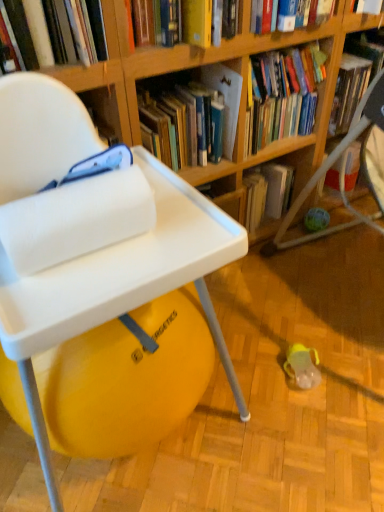
Question: Is hardcover book at upper left, which appears as the 3th book when viewed from the right, inside or outside of wooden bookshelf at center, which appears as the second shelf when viewed from the front?

Choices:
 (A) inside
 (B) outside

Answer: (B)

Question: From a real-world perspective, is hardcover book at upper left, which is counted as the first book, starting from the left, physically located above or below wooden bookshelf at center, placed as the 2th shelf when sorted from left to right?

Choices:
 (A) above
 (B) below

Answer: (A)

Question: Based on their relative distances, which object is farther from the white plastic chair at left?

Choices:
 (A) wooden bookshelf at center, positioned as the first shelf in right-to-left order
 (B) hardcover book at upper center, marked as the 2th book in a right-to-left arrangement
 (C) hardcover book at upper left, which appears as the 3th book when viewed from the right
 (D) wooden bookshelf at upper center, the 1th shelf positioned from the front
 (E) hardcover book at upper center, arranged as the first book when viewed from the right

Answer: (A)

Question: Estimate the real-world distances between objects in this image. Which object is closer to the hardcover book at upper center, the second book from the left?

Choices:
 (A) hardcover book at upper left, which is counted as the first book, starting from the left
 (B) wooden bookshelf at upper center, the first shelf viewed from the left
 (C) wooden bookshelf at center, the 1th shelf viewed from the back
 (D) white plastic chair at left
 (E) hardcover book at upper center, arranged as the third book when viewed from the left

Answer: (B)